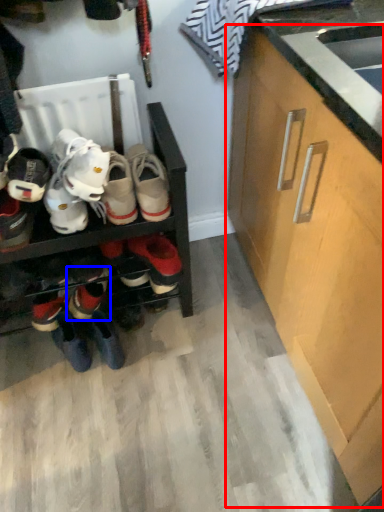
Question: Which point is closer to the camera, cabinetry (highlighted by a red box) or footwear (highlighted by a blue box)?

Choices:
 (A) cabinetry
 (B) footwear

Answer: (A)